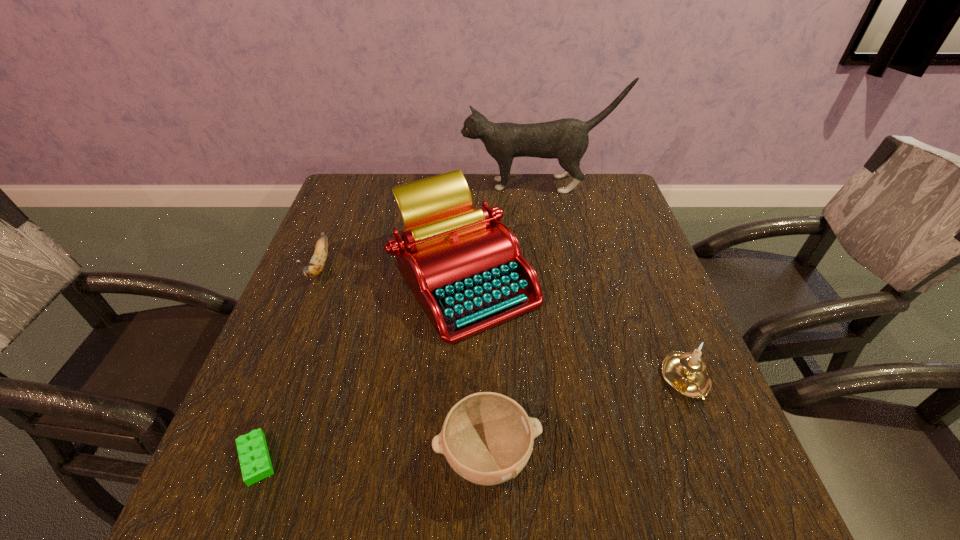
The image size is (960, 540). I want to click on the farthest object, so (x=567, y=140).

At what (x,y) coordinates should I click in order to perform the action: click on the tallest object. Please return your answer as a coordinate pair (x, y). Looking at the image, I should click on (567, 140).

Locate an element on the screen. typewriter is located at coordinates (465, 268).

This screenshot has height=540, width=960. In order to click on candle holder in this screenshot , I will do `click(686, 372)`.

Locate an element on the screen. the fourth shortest object is located at coordinates (686, 372).

Where is `banana`? The height and width of the screenshot is (540, 960). banana is located at coordinates (314, 268).

Identify the location of bowl. The image size is (960, 540). (487, 438).

The height and width of the screenshot is (540, 960). I want to click on the shortest object, so click(x=253, y=453).

Locate an element on the screen. blank space located 0.370m at the face of the tallest object is located at coordinates (343, 185).

The width and height of the screenshot is (960, 540). I want to click on vacant space located at the face of the tallest object, so click(x=446, y=185).